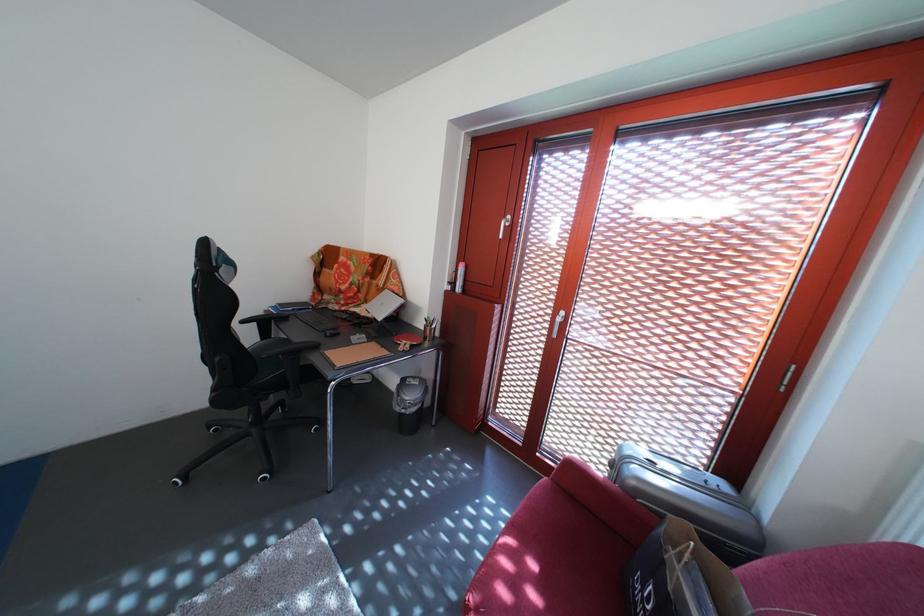
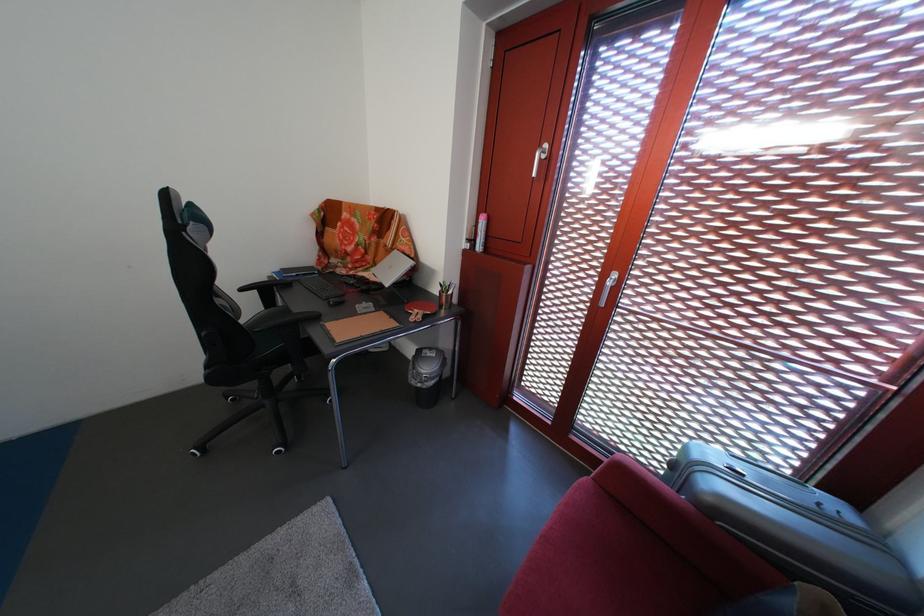
Locate, in the second image, the point that corresponds to pixel 275 339 in the first image.

(280, 308)